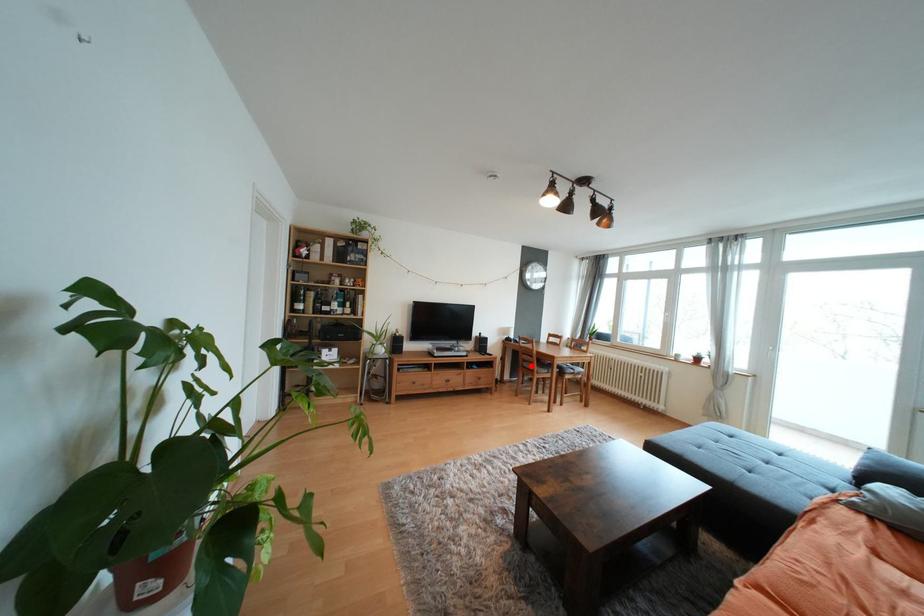
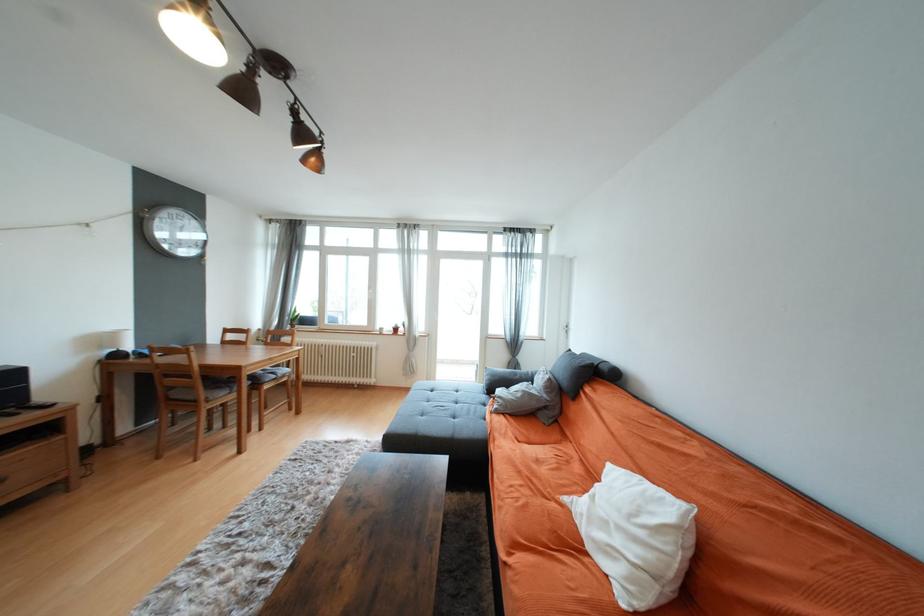
Question: I am providing you with two images of the same scene from different viewpoints. Image1 has a red point marked. In image2, the corresponding 3D location appears at what relative position? Reply with the corresponding letter.

Choices:
 (A) Closer
 (B) Farther

Answer: (A)